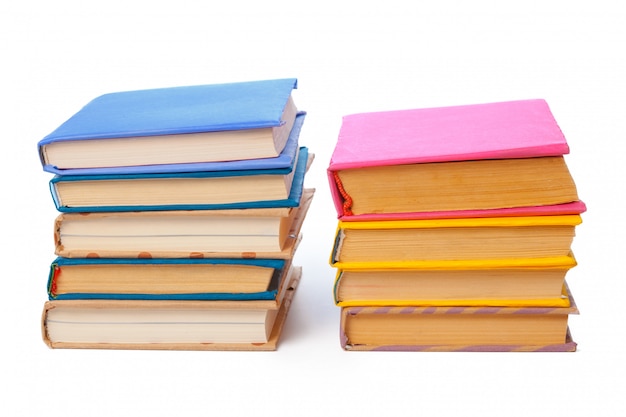
I want to click on books, so click(x=479, y=181), click(x=474, y=244), click(x=474, y=290), click(x=476, y=325), click(x=211, y=327), click(x=208, y=280), click(x=208, y=226), click(x=213, y=185), click(x=203, y=141).